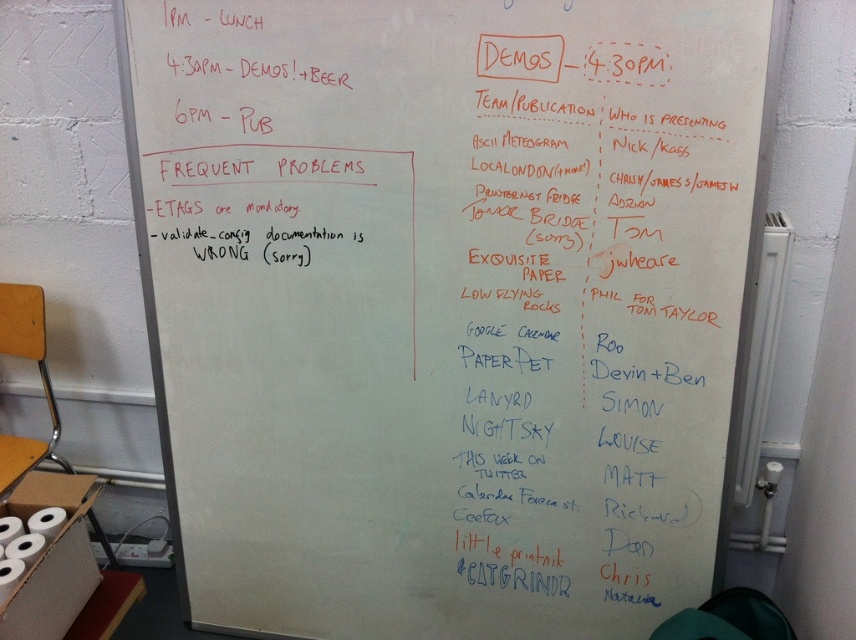
Is orange marker text at upper center positioned at the back of white matte toilet paper at lower left?

That is False.

At what (x,y) coordinates should I click in order to perform the action: click on orange marker text at upper center. Please return your answer as a coordinate pair (x, y). The width and height of the screenshot is (856, 640). Looking at the image, I should click on (519, 56).